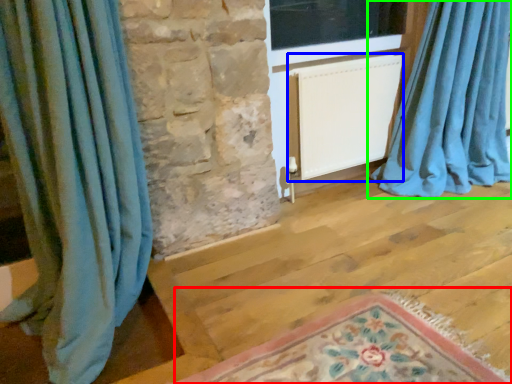
Question: Estimate the real-world distances between objects in this image. Which object is farther from mat (highlighted by a red box), radiator (highlighted by a blue box) or curtain (highlighted by a green box)?

Choices:
 (A) radiator
 (B) curtain

Answer: (B)